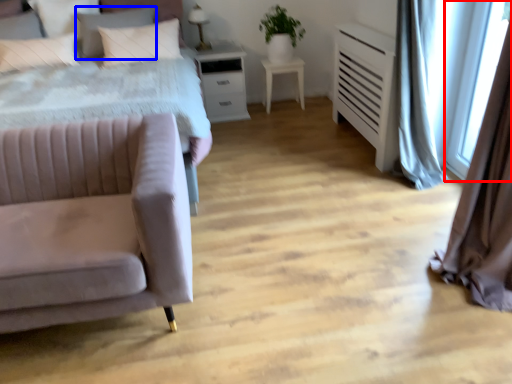
Question: Which point is further to the camera, window screen (highlighted by a red box) or pillow (highlighted by a blue box)?

Choices:
 (A) window screen
 (B) pillow

Answer: (B)